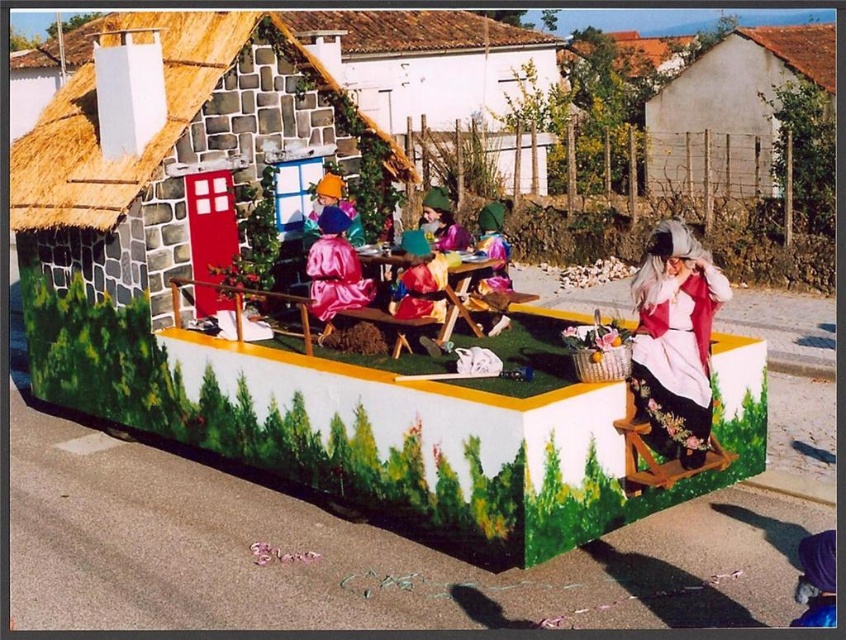
You are standing at the point marked as point (168, 152) on the float. What structure are you facing?

The point (168, 152) indicates stone textured hut at center, so you are facing the stone textured hut at center.